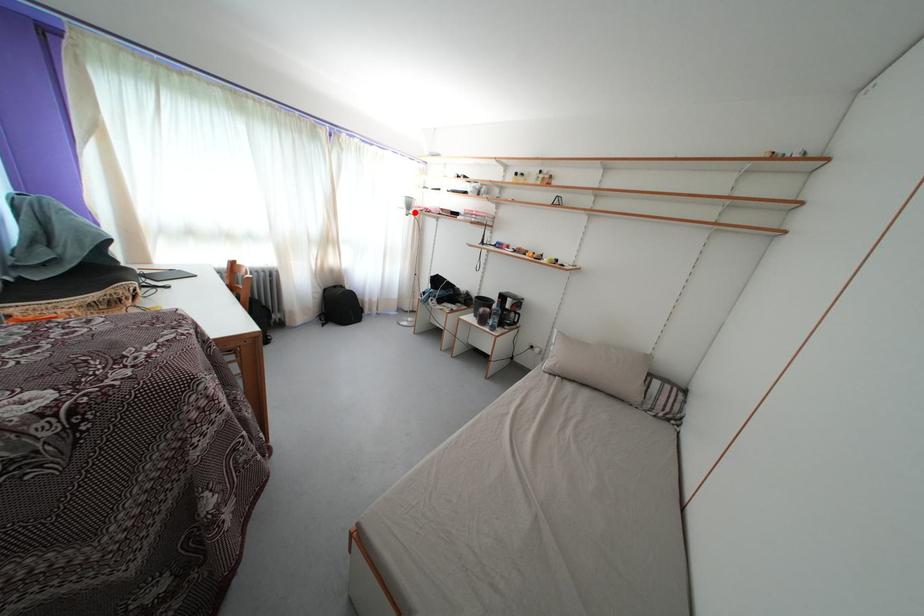
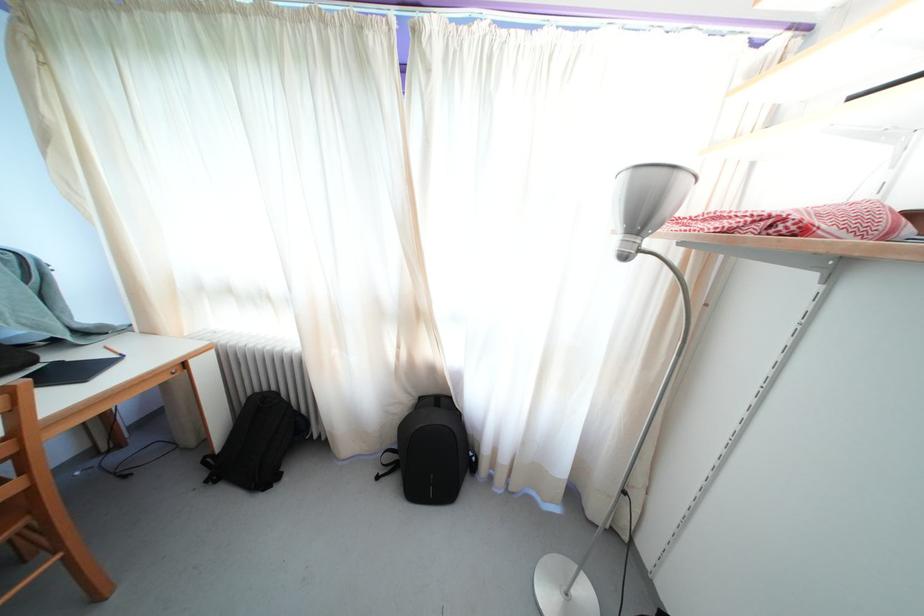
Question: A red point is marked in image1. In image2, is the corresponding 3D point closer to the camera or farther? Reply with the corresponding letter.

Choices:
 (A) The corresponding 3D point is closer.
 (B) The corresponding 3D point is farther.

Answer: (B)